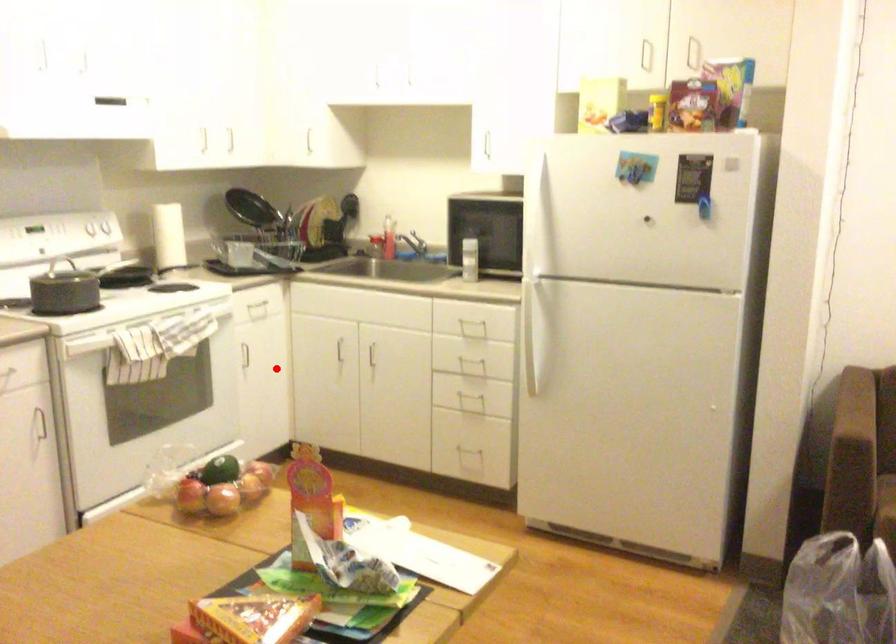
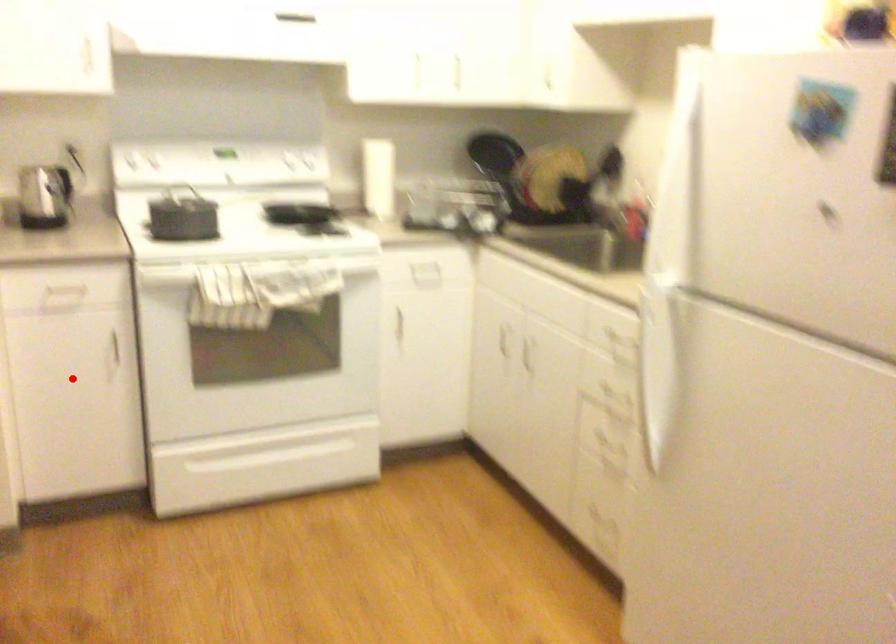
I am providing you with two images of the same scene from different viewpoints. A red point is marked on the first image and another point is marked on the second image. Is the red point in image1 aligned with the point shown in image2?

No